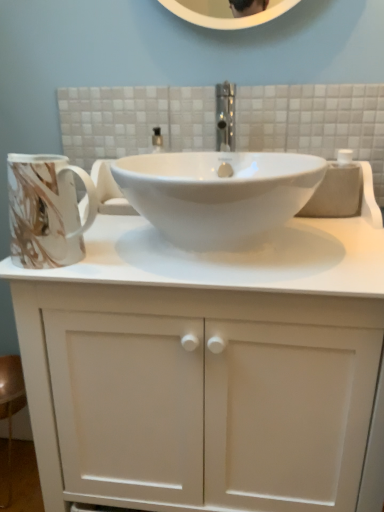
Question: Does white glossy sink at center have a lesser height compared to marbled ceramic mug at left?

Choices:
 (A) yes
 (B) no

Answer: (A)

Question: Considering the relative positions of white glossy sink at center and marbled ceramic mug at left in the image provided, is white glossy sink at center to the right of marbled ceramic mug at left from the viewer's perspective?

Choices:
 (A) no
 (B) yes

Answer: (B)

Question: From the image's perspective, is white glossy sink at center on top of marbled ceramic mug at left?

Choices:
 (A) no
 (B) yes

Answer: (B)

Question: Is white glossy sink at center taller than marbled ceramic mug at left?

Choices:
 (A) no
 (B) yes

Answer: (A)

Question: Is white glossy sink at center positioned far away from marbled ceramic mug at left?

Choices:
 (A) yes
 (B) no

Answer: (B)

Question: In terms of width, does marbled ceramic mug at left look wider or thinner when compared to white glossy sink at center?

Choices:
 (A) thin
 (B) wide

Answer: (A)

Question: From the image's perspective, is marbled ceramic mug at left located above or below white glossy sink at center?

Choices:
 (A) below
 (B) above

Answer: (A)

Question: Is marbled ceramic mug at left in front of or behind white glossy sink at center in the image?

Choices:
 (A) front
 (B) behind

Answer: (B)

Question: Is point (46, 165) positioned closer to the camera than point (205, 274)?

Choices:
 (A) farther
 (B) closer

Answer: (A)

Question: From a real-world perspective, is white glossy sink at center above or below marbled ceramic mug at left?

Choices:
 (A) above
 (B) below

Answer: (B)

Question: From the image's perspective, is white glossy sink at center located above or below marbled ceramic mug at left?

Choices:
 (A) above
 (B) below

Answer: (A)

Question: Considering the positions of white glossy sink at center and marbled ceramic mug at left in the image, is white glossy sink at center bigger or smaller than marbled ceramic mug at left?

Choices:
 (A) small
 (B) big

Answer: (B)

Question: In terms of width, does white glossy sink at center look wider or thinner when compared to marbled ceramic mug at left?

Choices:
 (A) wide
 (B) thin

Answer: (A)

Question: Considering the positions of marbled ceramic mug at left and white matte cabinet at center in the image, is marbled ceramic mug at left wider or thinner than white matte cabinet at center?

Choices:
 (A) thin
 (B) wide

Answer: (A)

Question: Considering the positions of point (64, 189) and point (215, 262), is point (64, 189) closer or farther from the camera than point (215, 262)?

Choices:
 (A) closer
 (B) farther

Answer: (A)